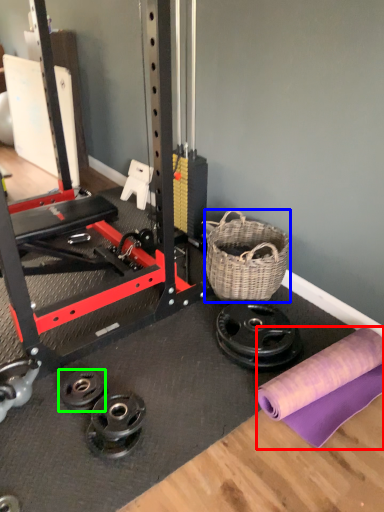
Question: Considering the real-world distances, which object is farthest from fabric (highlighted by a red box)? basket (highlighted by a blue box) or wheel (highlighted by a green box)?

Choices:
 (A) basket
 (B) wheel

Answer: (B)